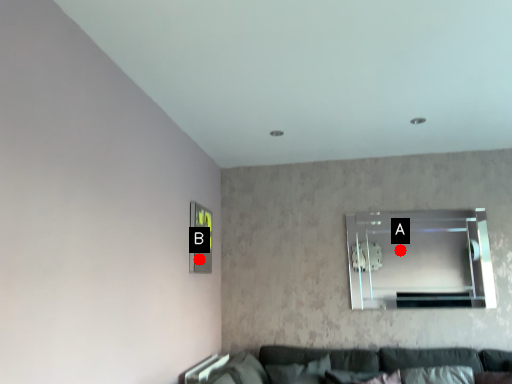
Question: Two points are circled on the image, labeled by A and B beside each circle. Which of the following is the closest to the observer?

Choices:
 (A) A is closer
 (B) B is closer

Answer: (B)